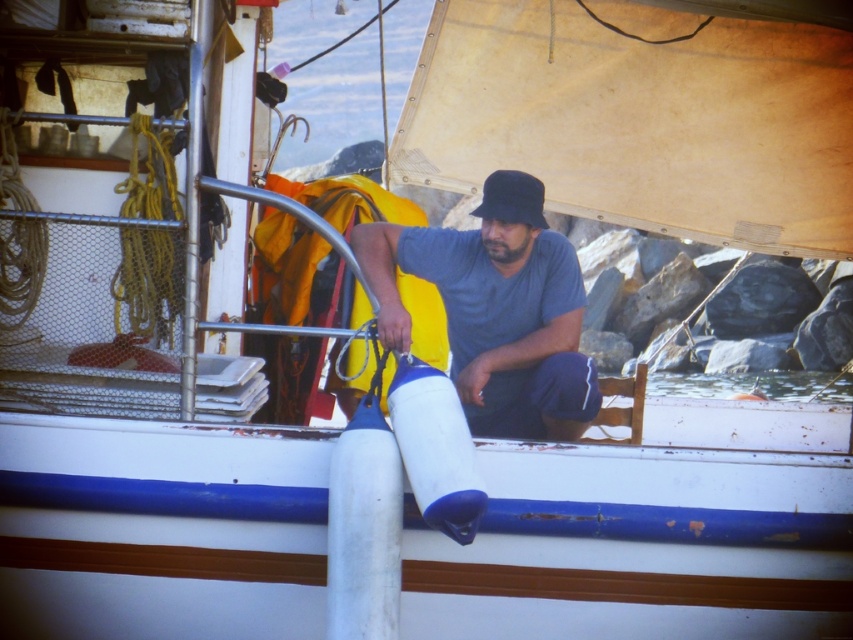
Is clear water at lower center to the left of black fabric baseball hat at center from the viewer's perspective?

Incorrect, clear water at lower center is not on the left side of black fabric baseball hat at center.

Between clear water at lower center and black fabric baseball hat at center, which one is positioned lower?

clear water at lower center

The image size is (853, 640). What do you see at coordinates (738, 384) in the screenshot?
I see `clear water at lower center` at bounding box center [738, 384].

This screenshot has width=853, height=640. I want to click on clear water at lower center, so click(738, 384).

Which is behind, point (502, 289) or point (525, 216)?

Positioned behind is point (502, 289).

Which of these two, gray matte shirt at center or black fabric baseball hat at center, stands taller?

gray matte shirt at center is taller.

Between point (564, 264) and point (519, 220), which one is positioned in front?

Point (519, 220) is more forward.

You are a GUI agent. You are given a task and a screenshot of the screen. Output one action in this format:
    pyautogui.click(x=<x>, y=<y>)
    Task: Click on the gray matte shirt at center
    Image resolution: width=853 pixels, height=640 pixels.
    Given the screenshot: What is the action you would take?
    pyautogui.click(x=496, y=310)

Who is lower down, gray matte shirt at center or clear water at lower center?

Positioned lower is clear water at lower center.

Is point (556, 342) positioned before point (688, 392)?

Yes, point (556, 342) is closer to viewer.

This screenshot has height=640, width=853. What do you see at coordinates (496, 310) in the screenshot?
I see `gray matte shirt at center` at bounding box center [496, 310].

Find the location of a particular element. This screenshot has height=640, width=853. gray matte shirt at center is located at coordinates (496, 310).